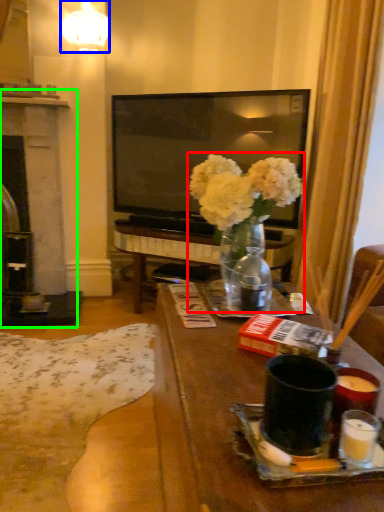
Question: Based on their relative distances, which object is nearer to floral arrangement (highlighted by a red box)? Choose from lamp (highlighted by a blue box) and fireplace (highlighted by a green box).

Choices:
 (A) lamp
 (B) fireplace

Answer: (B)